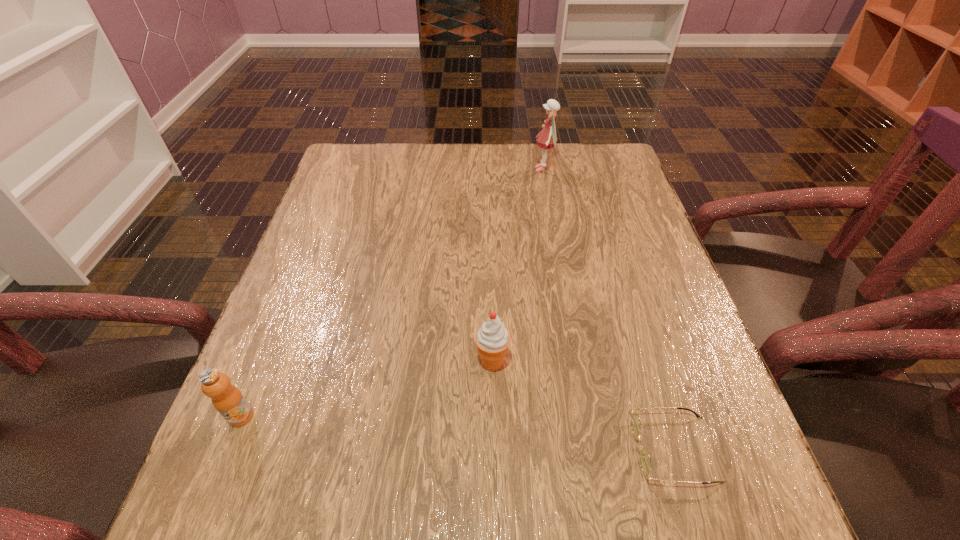
In order to click on free space located on the left of the icecream in this screenshot , I will do `click(377, 362)`.

At what (x,y) coordinates should I click in order to perform the action: click on vacant space located on the front label of the leftmost object. Please return your answer as a coordinate pair (x, y). The image size is (960, 540). Looking at the image, I should click on (204, 507).

Image resolution: width=960 pixels, height=540 pixels. I want to click on vacant area situated 0.060m on the lenses of the spectacles, so click(x=596, y=449).

The image size is (960, 540). I want to click on vacant space situated 0.230m on the lenses of the spectacles, so click(489, 449).

You are a GUI agent. You are given a task and a screenshot of the screen. Output one action in this format:
    pyautogui.click(x=<x>, y=<y>)
    Task: Click on the vacant region located 0.060m on the lenses of the spectacles
    Image resolution: width=960 pixels, height=540 pixels.
    Given the screenshot: What is the action you would take?
    pyautogui.click(x=596, y=449)

Image resolution: width=960 pixels, height=540 pixels. I want to click on object that is at the far edge, so click(547, 138).

You are a GUI agent. You are given a task and a screenshot of the screen. Output one action in this format:
    pyautogui.click(x=<x>, y=<y>)
    Task: Click on the object that is at the near edge
    This screenshot has width=960, height=540.
    Given the screenshot: What is the action you would take?
    pyautogui.click(x=645, y=461)

Where is `object positioned at the left edge`? This screenshot has width=960, height=540. object positioned at the left edge is located at coordinates (227, 399).

In order to click on object positioned at the right edge in this screenshot , I will do `click(645, 461)`.

Find the location of `object at the near right corner`. object at the near right corner is located at coordinates (645, 461).